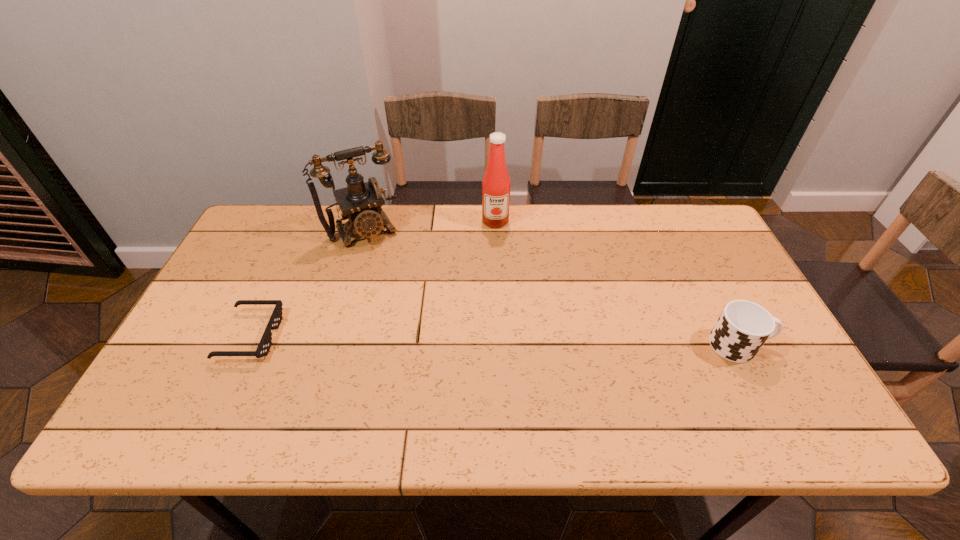
At what (x,y) coordinates should I click in order to perform the action: click on free space on the desktop that is between the shortest object and the rightmost object and is positioned on the rotary dial of the second object from left to right. Please return your answer as a coordinate pair (x, y). This screenshot has height=540, width=960. Looking at the image, I should click on click(420, 339).

Locate an element on the screen. This screenshot has width=960, height=540. vacant space on the desktop that is between the sunglasses and the second shortest object and is positioned on the front-facing side of the condiment is located at coordinates (500, 341).